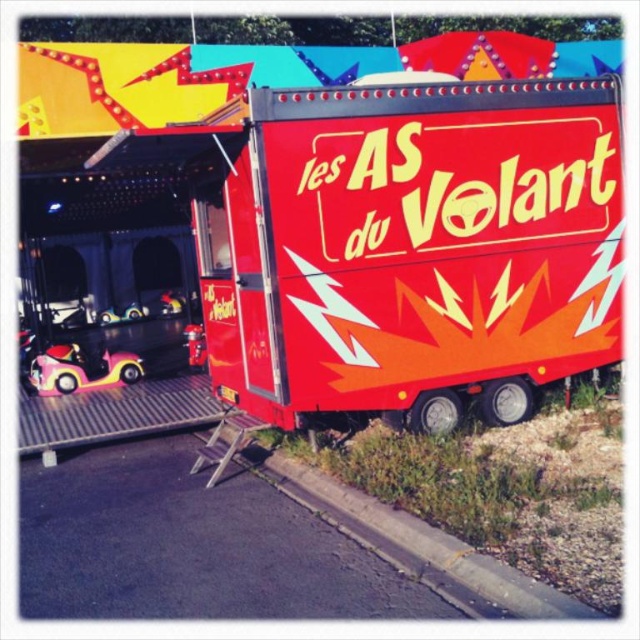
You are a fairground worker who needs to move a 1.8 meter wide equipment cart between the shiny red trailer truck at center and the shiny red trailer at center. Can the cart fit through the space between them?

The shiny red trailer truck at center and the shiny red trailer at center are 2.03 meters apart, so the 1.8 meter wide equipment cart can fit through the space between them since 2.03 meters is wider than 1.8 meters.

You are a parent at the fairground holding a pink rubber toy car at left for your child. There is also a pink rubber bumper car at lower left nearby. Your child wants to place the toy car into the bumper car. Can the toy car fit inside the bumper car?

The pink rubber toy car at left and pink rubber bumper car at lower left are 28.22 inches apart from each other. However, the distance between them does not indicate the size of the toy car relative to the bumper car, so it is unclear if the toy car can fit inside the bumper car based on this information alone.